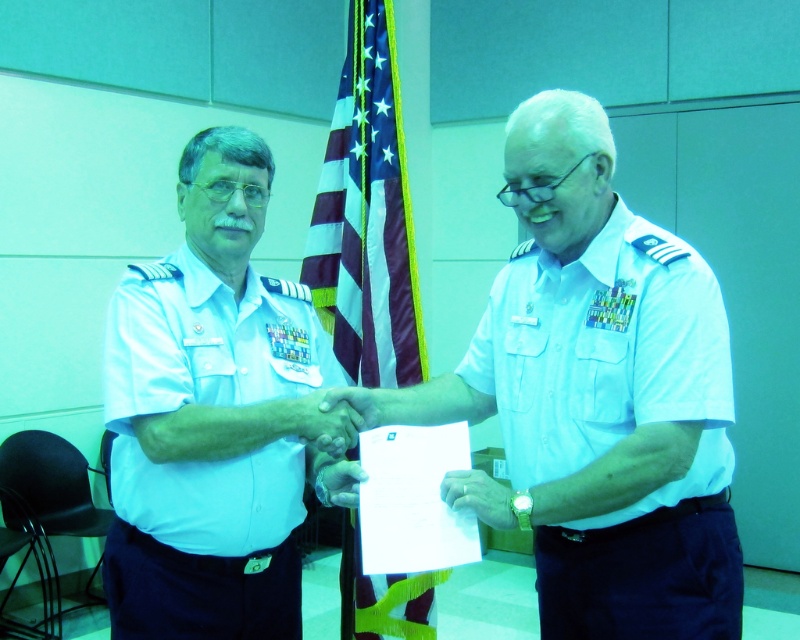
What are the coordinates of the white cotton shirt at center?

The white cotton shirt at center is located at point (x=618, y=428).

You are an observer at the ceremony. You notice the white cotton shirt at left and the white matte hand at center. Which object is positioned higher in the image?

The white cotton shirt at left is taller than the white matte hand at center, so the white cotton shirt at left is positioned higher in the image.